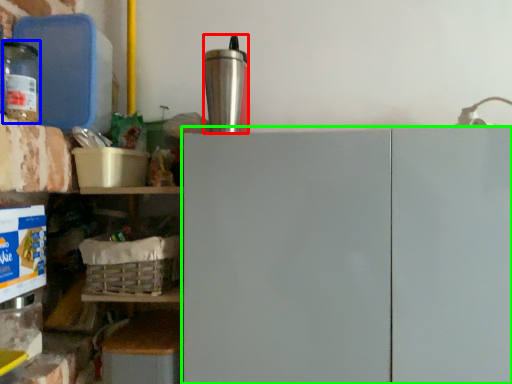
Question: Considering the real-world distances, which object is closest to appliance (highlighted by a red box)? bottle (highlighted by a blue box) or cabinetry (highlighted by a green box).

Choices:
 (A) bottle
 (B) cabinetry

Answer: (B)